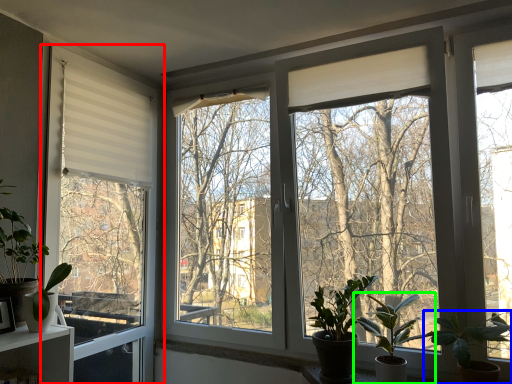
Question: Estimate the real-world distances between objects in this image. Which object is closer to window (highlighted by a red box), houseplant (highlighted by a blue box) or houseplant (highlighted by a green box)?

Choices:
 (A) houseplant
 (B) houseplant

Answer: (B)